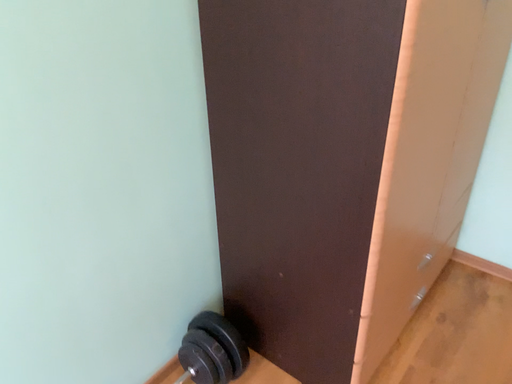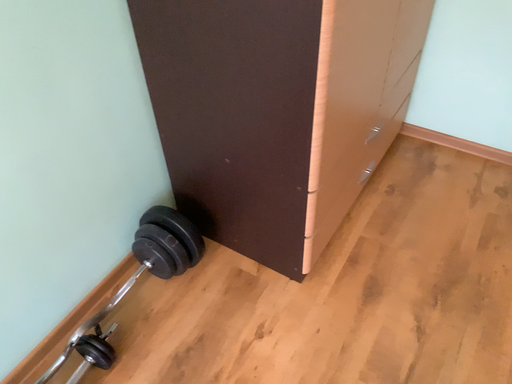
Question: Which way did the camera rotate in the video?

Choices:
 (A) rotated upward
 (B) rotated downward

Answer: (B)